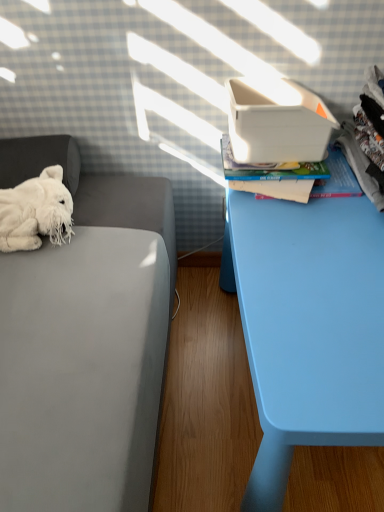
Question: Is there a large distance between hardcover book at upper right and white plastic shoe box at upper right?

Choices:
 (A) no
 (B) yes

Answer: (A)

Question: Is hardcover book at upper right wider than white plastic shoe box at upper right?

Choices:
 (A) no
 (B) yes

Answer: (B)

Question: Can you confirm if hardcover book at upper right is shorter than white plastic shoe box at upper right?

Choices:
 (A) yes
 (B) no

Answer: (A)

Question: Considering the relative positions of hardcover book at upper right and white plastic shoe box at upper right in the image provided, is hardcover book at upper right behind white plastic shoe box at upper right?

Choices:
 (A) yes
 (B) no

Answer: (A)

Question: Is hardcover book at upper right taller than white plastic shoe box at upper right?

Choices:
 (A) yes
 (B) no

Answer: (B)

Question: Is light blue plastic table at right wider or thinner than white fluffy stuffed animal at left?

Choices:
 (A) wide
 (B) thin

Answer: (A)

Question: Do you think light blue plastic table at right is within white fluffy stuffed animal at left, or outside of it?

Choices:
 (A) outside
 (B) inside

Answer: (A)

Question: Considering the positions of point (266, 490) and point (44, 220), is point (266, 490) closer or farther from the camera than point (44, 220)?

Choices:
 (A) closer
 (B) farther

Answer: (A)

Question: Is light blue plastic table at right in front of or behind white fluffy stuffed animal at left in the image?

Choices:
 (A) front
 (B) behind

Answer: (A)

Question: Looking at their shapes, would you say hardcover book at upper right is wider or thinner than white fluffy stuffed animal at left?

Choices:
 (A) wide
 (B) thin

Answer: (A)

Question: Do you think hardcover book at upper right is within white fluffy stuffed animal at left, or outside of it?

Choices:
 (A) inside
 (B) outside

Answer: (B)

Question: In terms of height, does hardcover book at upper right look taller or shorter compared to white fluffy stuffed animal at left?

Choices:
 (A) tall
 (B) short

Answer: (B)

Question: Considering the positions of point (274, 175) and point (51, 176), is point (274, 175) closer or farther from the camera than point (51, 176)?

Choices:
 (A) farther
 (B) closer

Answer: (B)

Question: Considering the positions of light blue plastic table at right and white plush toy at left in the image, is light blue plastic table at right wider or thinner than white plush toy at left?

Choices:
 (A) wide
 (B) thin

Answer: (A)

Question: From a real-world perspective, is light blue plastic table at right positioned above or below white plush toy at left?

Choices:
 (A) above
 (B) below

Answer: (B)